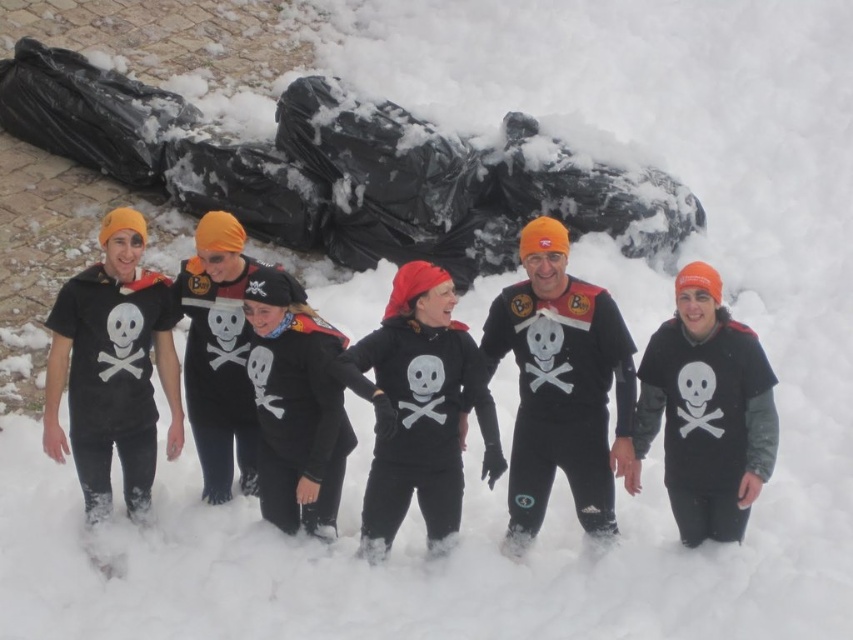
Question: Which object appears closest to the camera in this image?

Choices:
 (A) matte black shirt at center
 (B) black matte sweatshirt at center

Answer: (B)

Question: Which point is farther from the camera taking this photo?

Choices:
 (A) click(x=682, y=435)
 (B) click(x=512, y=296)
 (C) click(x=419, y=358)

Answer: (B)

Question: Does matte black wetsuit at center come behind matte black t-shirt at left?

Choices:
 (A) yes
 (B) no

Answer: (B)

Question: Is matte black wetsuit at center smaller than black matte sweatshirt at center?

Choices:
 (A) yes
 (B) no

Answer: (B)

Question: Among these points, which one is farthest from the camera?

Choices:
 (A) (770, 442)
 (B) (469, 360)

Answer: (B)

Question: Is matte black t-shirt at left positioned behind black matte sweatshirt at center?

Choices:
 (A) no
 (B) yes

Answer: (B)